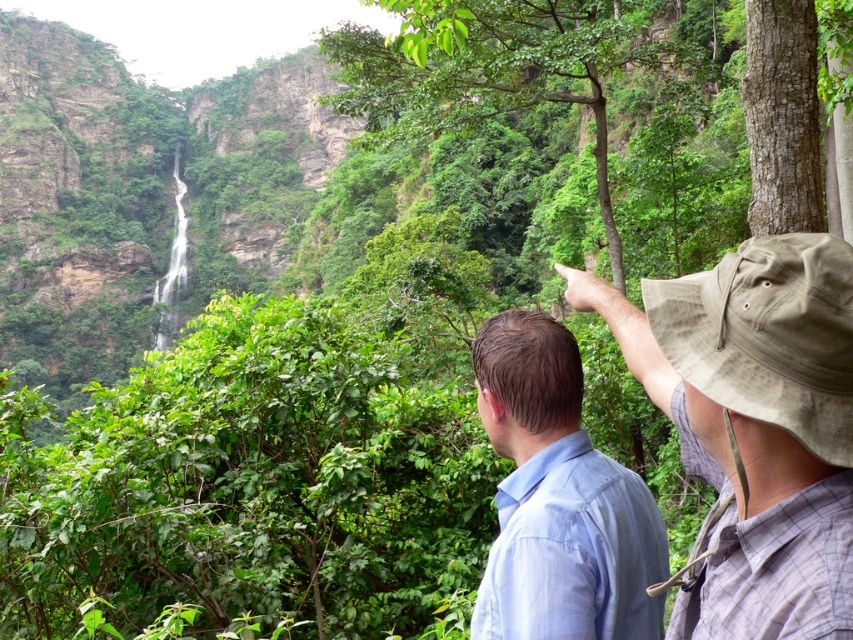
Question: Which object is closer to the camera taking this photo?

Choices:
 (A) khaki canvas hat at upper right
 (B) brown rough bark tree at upper right

Answer: (A)

Question: Which object appears farthest from the camera in this image?

Choices:
 (A) light blue shirt at center
 (B) green leafy tree at upper center

Answer: (B)

Question: Which of the following is the farthest from the observer?

Choices:
 (A) [548, 45]
 (B) [772, 45]
 (C) [850, 483]
 (D) [482, 584]

Answer: (A)

Question: Does khaki canvas hat at upper right appear over brown rough bark tree at upper right?

Choices:
 (A) no
 (B) yes

Answer: (A)

Question: Can you confirm if light blue shirt at center is positioned to the right of brown rough bark tree at upper right?

Choices:
 (A) no
 (B) yes

Answer: (A)

Question: Is light blue shirt at center to the right of green leafy tree at upper center from the viewer's perspective?

Choices:
 (A) no
 (B) yes

Answer: (A)